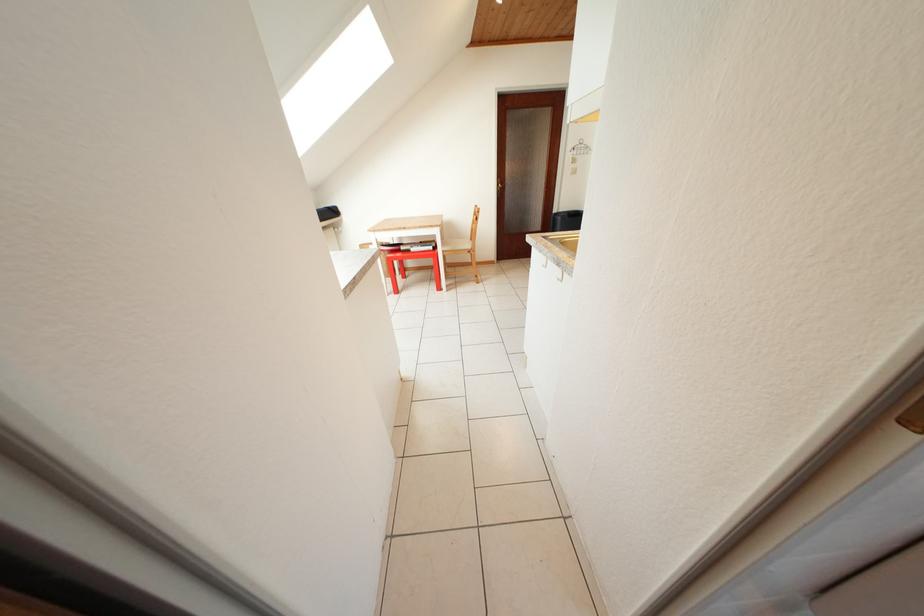
Find where to turn the brass door handle. Please return your answer as a coordinate pair (x, y).

(501, 185)